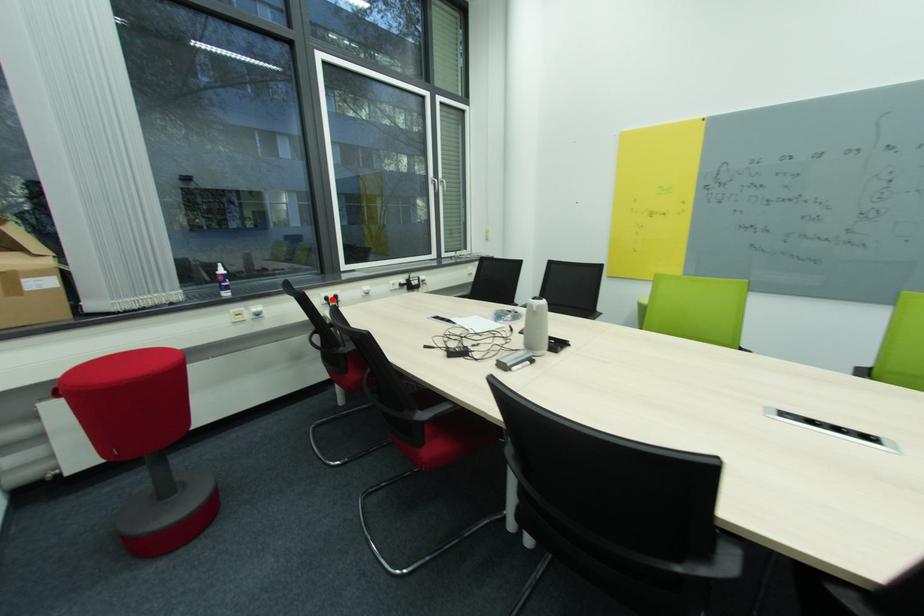
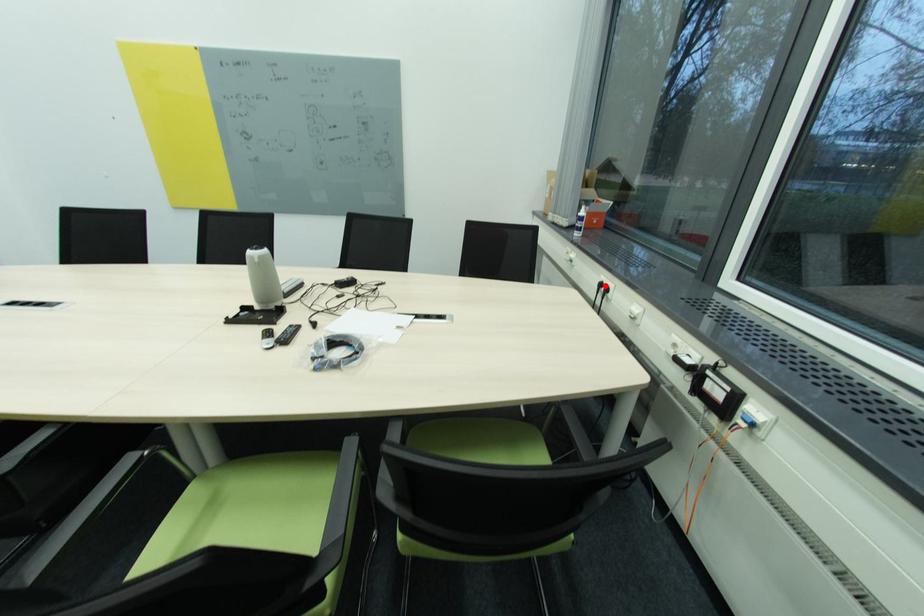
I am providing you with two images of the same scene from different viewpoints. A red point is marked on the first image and another point is marked on the second image. Do the highlighted points in image1 and image2 indicate the same real-world spot?

Yes